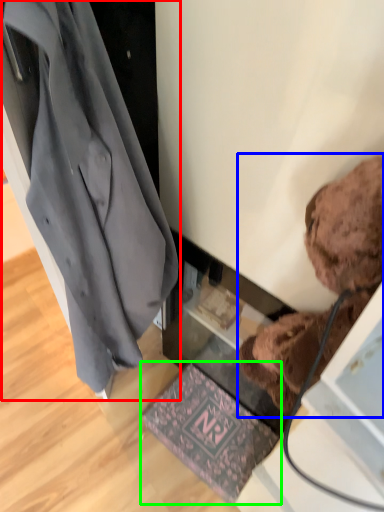
Question: Which object is the closest to the coat (highlighted by a red box)? Choose among these: teddy bear (highlighted by a blue box) or mat (highlighted by a green box).

Choices:
 (A) teddy bear
 (B) mat

Answer: (A)